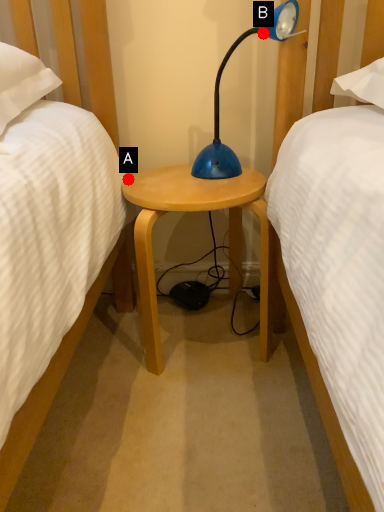
Question: Two points are circled on the image, labeled by A and B beside each circle. Which point appears closest to the camera in this image?

Choices:
 (A) A is closer
 (B) B is closer

Answer: (B)